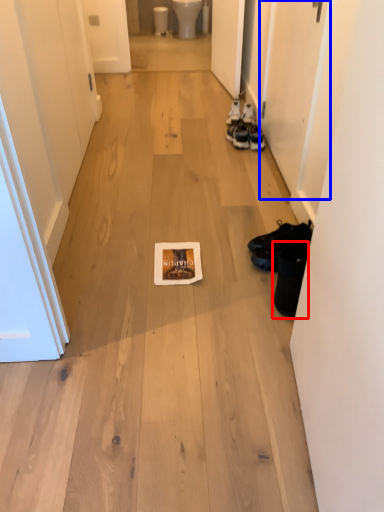
Question: Which object appears farthest to the camera in this image, footwear (highlighted by a red box) or door (highlighted by a blue box)?

Choices:
 (A) footwear
 (B) door

Answer: (B)